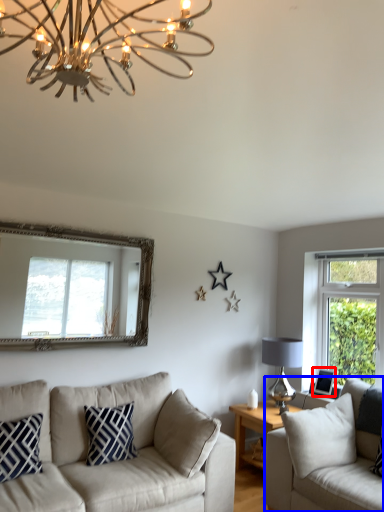
Question: Which point is further to the camera, picture frame (highlighted by a red box) or studio couch (highlighted by a blue box)?

Choices:
 (A) picture frame
 (B) studio couch

Answer: (A)